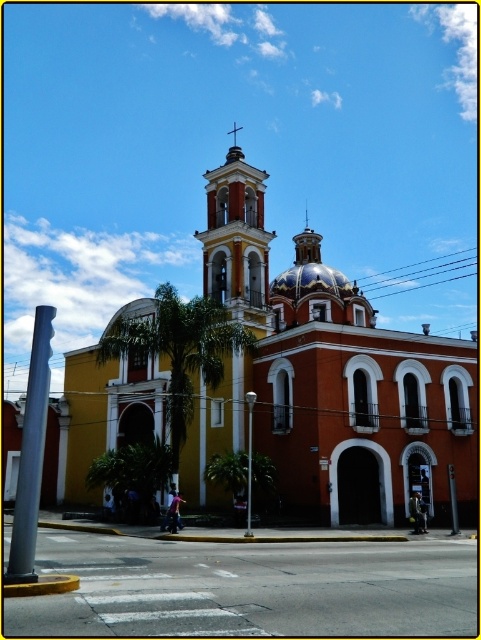
Is orange stucco church at center to the left of matte orange bell tower at center from the viewer's perspective?

No, orange stucco church at center is not to the left of matte orange bell tower at center.

Is orange stucco church at center to the right of matte orange bell tower at center from the viewer's perspective?

Indeed, orange stucco church at center is positioned on the right side of matte orange bell tower at center.

Find the location of a particular element. orange stucco church at center is located at coordinates (325, 380).